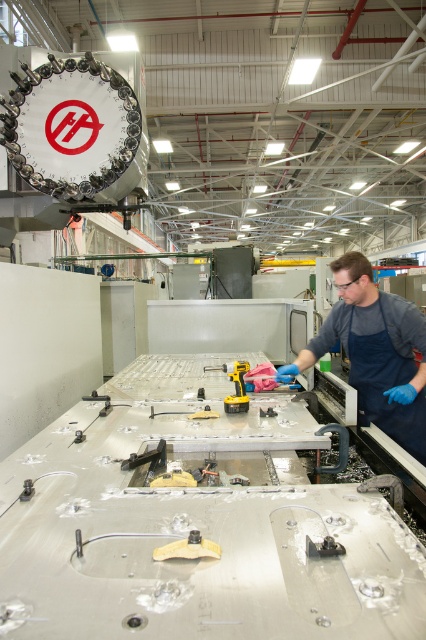
Is blue rubber gloves at right in front of yellow plastic drill at center?

No, it is behind yellow plastic drill at center.

Who is more forward, (348, 260) or (232, 396)?

Point (348, 260)

At what (x,y) coordinates should I click in order to perform the action: click on blue rubber gloves at right. Please return your answer as a coordinate pair (x, y). Looking at the image, I should click on (376, 353).

Which of these two, dark blue fabric apron at right or metallic gray tool at center, stands taller?

With more height is dark blue fabric apron at right.

From the picture: Can you confirm if dark blue fabric apron at right is bigger than metallic gray tool at center?

Yes.

This screenshot has height=640, width=426. I want to click on dark blue fabric apron at right, so click(x=386, y=388).

Is point (158, 547) more distant than point (209, 416)?

That is False.

Between point (206, 541) and point (152, 412), which one is positioned behind?

Positioned behind is point (152, 412).

Consider the image. Measure the distance between point (x=207, y=545) and camera.

They are 1.07 meters apart.

Where is `yellow plastic tool at center`? The width and height of the screenshot is (426, 640). yellow plastic tool at center is located at coordinates (187, 547).